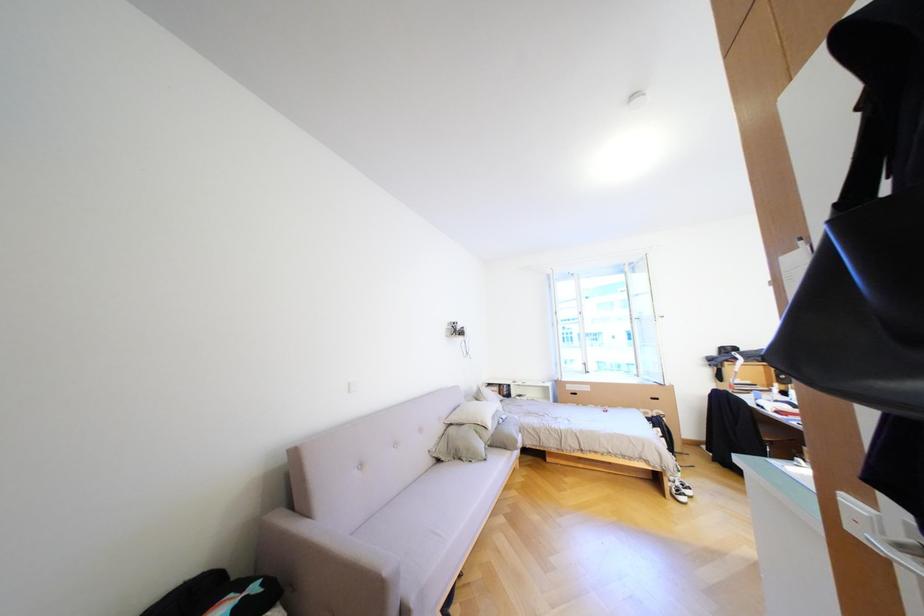
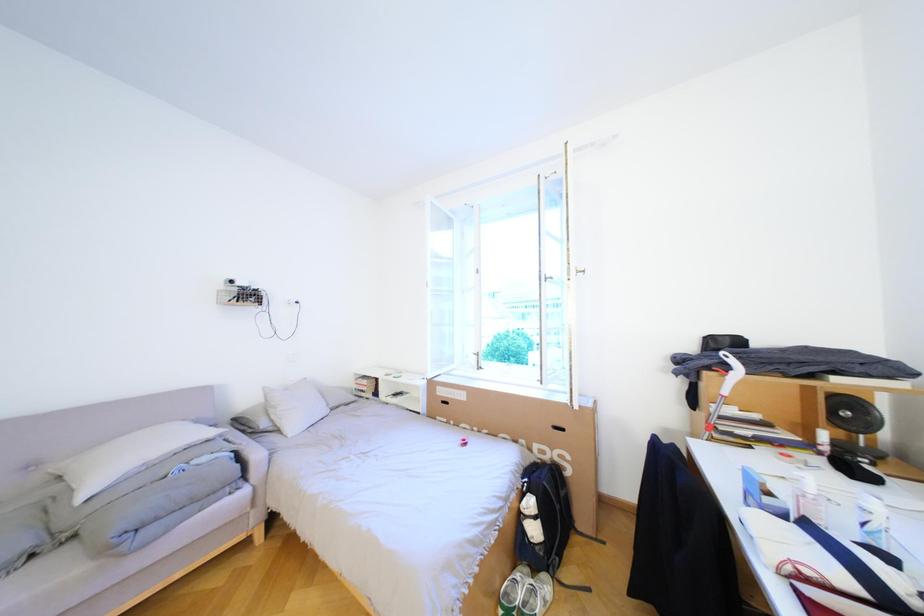
In a continuous first-person perspective shot, in which direction is the camera moving?

The movement direction of the cameraman is right, forward.